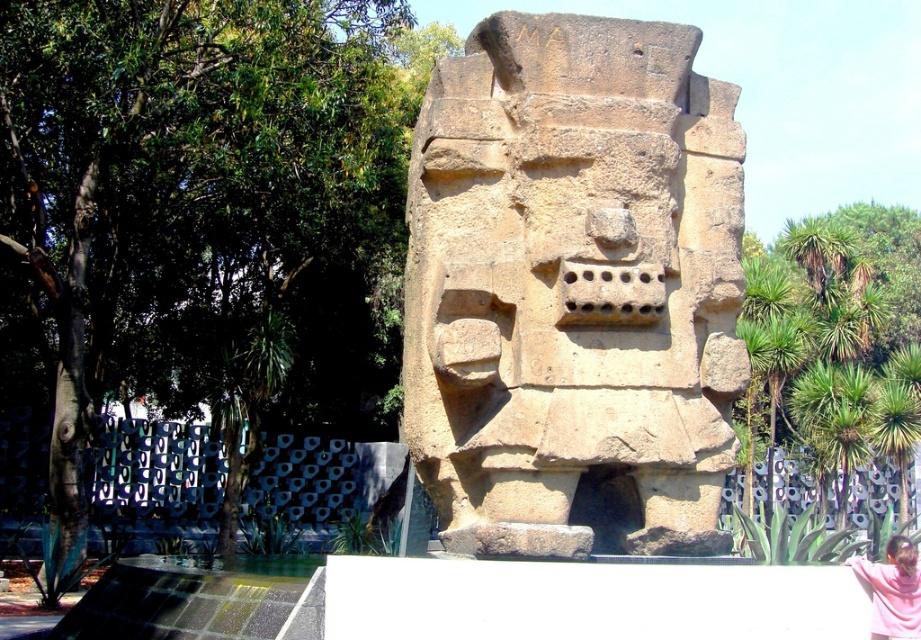
You are a photographer planning to take a photo of the brown stone sculpture at center and the pink fabric at lower right. Since you want both subjects to be clearly visible in the frame, which object should you focus on first to ensure proper depth of field?

The brown stone sculpture at center should be focused on first because it is taller than the pink fabric at lower right, ensuring that the larger subject is in sharp focus while the smaller one remains visible in the background.

You are a visitor at the park and want to take a photo of the brown stone sculpture at center and the pink fabric at lower right together in the frame. Based on their positions, which object should you focus on first to ensure both are in the shot?

The brown stone sculpture at center is located above the pink fabric at lower right, so you should focus on the brown stone sculpture at center first to ensure both are in the shot.